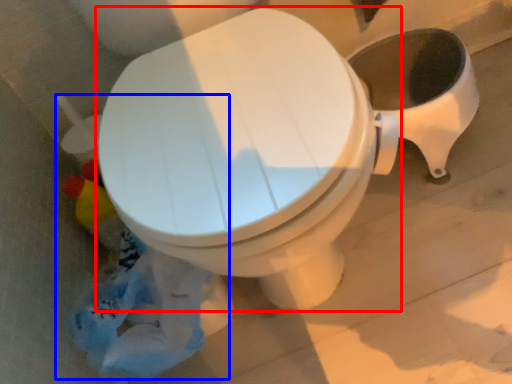
Question: Among these objects, which one is farthest to the camera, toilet (highlighted by a red box) or garbage (highlighted by a blue box)?

Choices:
 (A) toilet
 (B) garbage

Answer: (A)